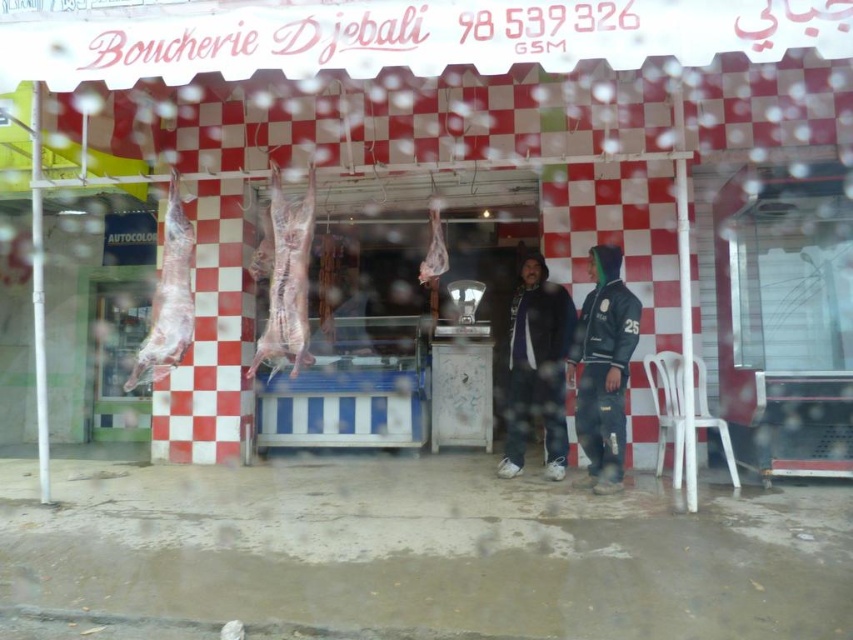
You are a customer standing at the entrance of the Boucherie Djebali. You see two types of pink raw meat at center and pinkish raw meat at center hanging from the ceiling. Which one is closer to you?

The pink raw meat at center is closer to you because it is in front of the pinkish raw meat at center.

You are a customer entering the butcher shop and see the dark blue leather jacket at center and the raw meat at left. Which item is closer to you as you stand at the entrance?

The dark blue leather jacket at center is closer to you because it is further to the viewer than the raw meat at left.

You are standing in front of the Boucherie Djebali butcher shop and notice two points marked on the storefront. The first point is at coordinates point (529, 390) and the second at point (444, 268). Which point is closer to you?

Point (444, 268) is closer to you because it is less further to the camera than point (529, 390).